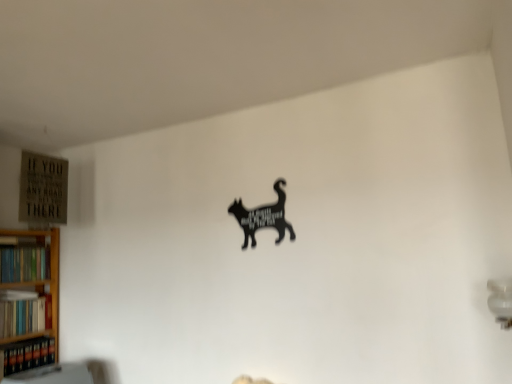
Question: Should I look upward or downward to see hardcover books at left, the 1th book positioned from the top?

Choices:
 (A) up
 (B) down

Answer: (B)

Question: Does hardcover books at left, the 2th book when ordered from bottom to top, have a greater width compared to black matte cat at center?

Choices:
 (A) no
 (B) yes

Answer: (B)

Question: Does hardcover books at left, the 2th book when ordered from bottom to top, appear on the left side of black matte cat at center?

Choices:
 (A) yes
 (B) no

Answer: (A)

Question: Is hardcover books at left, the 2th book when ordered from bottom to top, positioned in front of black matte cat at center?

Choices:
 (A) no
 (B) yes

Answer: (A)

Question: Considering the relative sizes of hardcover books at left, the 2th book when ordered from bottom to top, and black matte cat at center in the image provided, is hardcover books at left, the 2th book when ordered from bottom to top, taller than black matte cat at center?

Choices:
 (A) no
 (B) yes

Answer: (A)

Question: Are hardcover books at left, the 2th book when ordered from bottom to top, and black matte cat at center making contact?

Choices:
 (A) no
 (B) yes

Answer: (A)

Question: Considering the relative positions of hardcover books at left, the second book in the top-to-bottom sequence, and black matte cat at center in the image provided, is hardcover books at left, the second book in the top-to-bottom sequence, to the right of black matte cat at center from the viewer's perspective?

Choices:
 (A) no
 (B) yes

Answer: (A)

Question: Can you confirm if hardcover books at left, positioned as the third book in bottom-to-top order, is smaller than hardcover books at left, the second book in the top-to-bottom sequence?

Choices:
 (A) yes
 (B) no

Answer: (B)

Question: Is hardcover books at left, the 1th book positioned from the top, further to the viewer compared to hardcover books at left, the second book in the top-to-bottom sequence?

Choices:
 (A) no
 (B) yes

Answer: (B)

Question: Considering the relative positions of hardcover books at left, positioned as the third book in bottom-to-top order, and hardcover books at left, the second book in the top-to-bottom sequence, in the image provided, is hardcover books at left, positioned as the third book in bottom-to-top order, to the left of hardcover books at left, the second book in the top-to-bottom sequence, from the viewer's perspective?

Choices:
 (A) yes
 (B) no

Answer: (A)

Question: From the image's perspective, does hardcover books at left, the 1th book positioned from the top, appear higher than hardcover books at left, the second book in the top-to-bottom sequence?

Choices:
 (A) yes
 (B) no

Answer: (A)

Question: Can you confirm if hardcover books at left, positioned as the third book in bottom-to-top order, is taller than hardcover books at left, the second book in the top-to-bottom sequence?

Choices:
 (A) yes
 (B) no

Answer: (B)

Question: Is hardcover books at left, positioned as the third book in bottom-to-top order, positioned with its back to hardcover books at left, the 2th book when ordered from bottom to top?

Choices:
 (A) yes
 (B) no

Answer: (B)

Question: Can you confirm if hardcover books at left, positioned as the third book in bottom-to-top order, is positioned to the right of black matte cat at center?

Choices:
 (A) yes
 (B) no

Answer: (B)